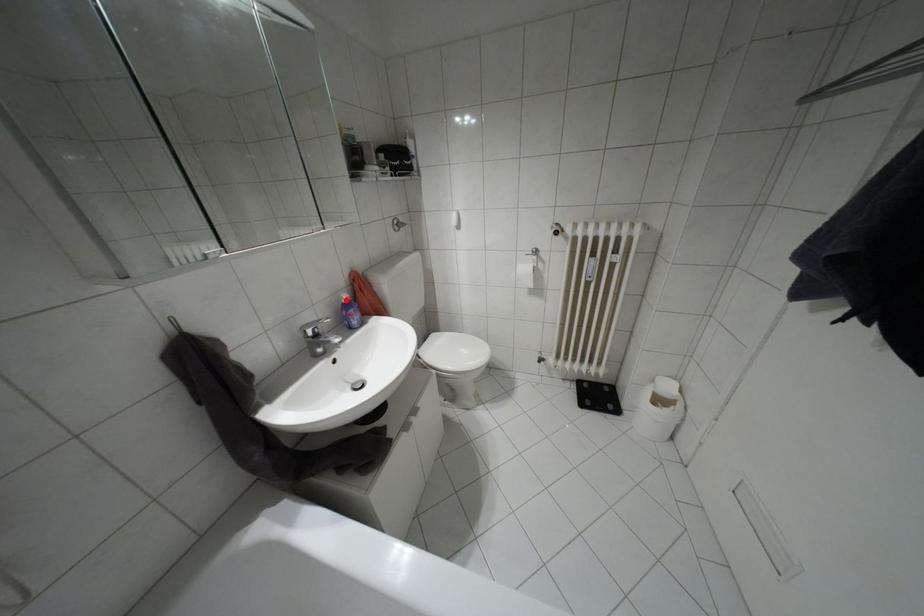
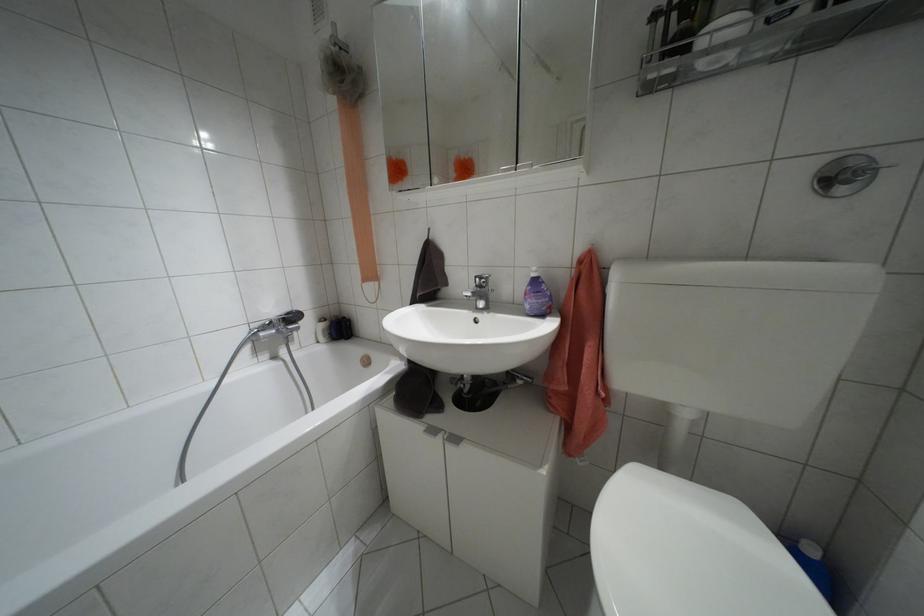
In the second image, find the point that corresponds to the highlighted location in the first image.

(532, 274)